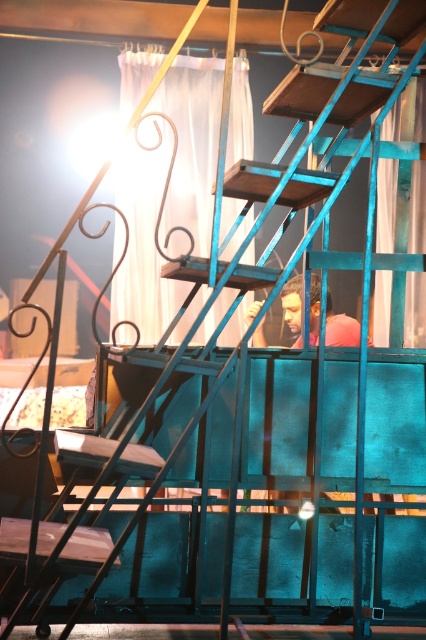
You are standing at the bottom of the staircase and see two points marked on the wall. The first point is at coordinate point (123,93) and the second is at coordinate point (393,180). Which point is closer to you?

Point (123,93) is closer to you because it is in front of point (393,180).

From the picture: You are standing at the bottom of the staircase and want to know where the white sheer curtain at upper center is positioned relative to your view. Can you describe its location using coordinates?

The white sheer curtain at upper center is located at coordinates point (385, 204).